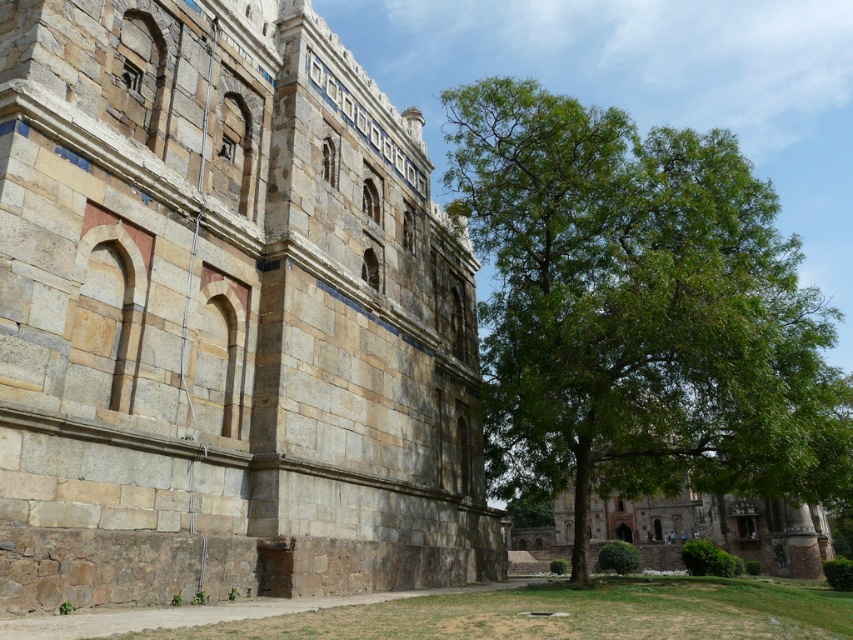
Is stone wall at center positioned before green leafy tree at right?

Yes, stone wall at center is in front of green leafy tree at right.

Which is behind, point (265, 442) or point (689, 218)?

Point (689, 218)

Find the location of a particular element. stone wall at center is located at coordinates (224, 316).